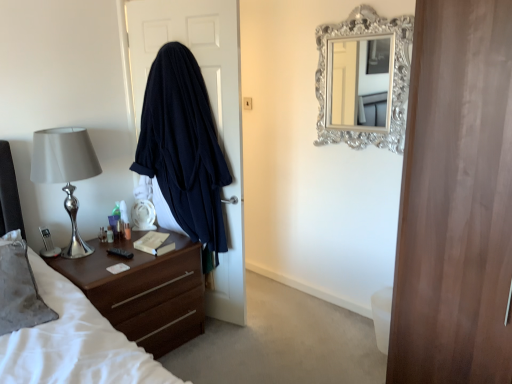
What are the coordinates of `free space to the left of black plastic remote control at left` in the screenshot? It's located at (99, 256).